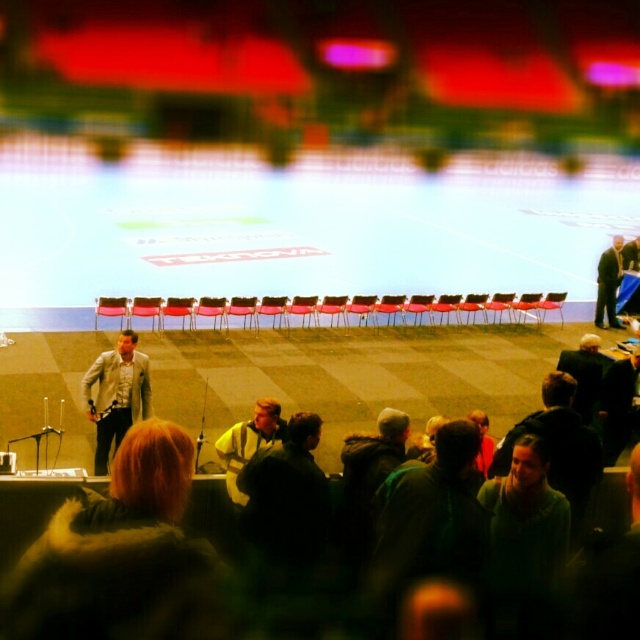
Which is above, yellow-green safety vest at center or dark gray suit at right?

dark gray suit at right

Does yellow-green safety vest at center have a smaller size compared to dark gray suit at right?

Yes.

Which is in front, point (228, 452) or point (605, 252)?

Point (228, 452) is in front.

Where is `yellow-green safety vest at center`? This screenshot has height=640, width=640. yellow-green safety vest at center is located at coordinates (248, 442).

Does light gray textured blazer at center have a larger size compared to dark gray jacket at right?

Correct, light gray textured blazer at center is larger in size than dark gray jacket at right.

Identify the location of light gray textured blazer at center. Image resolution: width=640 pixels, height=640 pixels. (116, 394).

What do you see at coordinates (116, 394) in the screenshot? The width and height of the screenshot is (640, 640). I see `light gray textured blazer at center` at bounding box center [116, 394].

The width and height of the screenshot is (640, 640). I want to click on light gray textured blazer at center, so click(116, 394).

Can you confirm if yellow-green safety vest at center is thinner than dark gray jacket at right?

In fact, yellow-green safety vest at center might be wider than dark gray jacket at right.

Between yellow-green safety vest at center and dark gray jacket at right, which one is positioned lower?

yellow-green safety vest at center

Who is more distant from viewer, (x=230, y=452) or (x=580, y=372)?

The point (x=580, y=372) is behind.

Identify the location of yellow-green safety vest at center. Image resolution: width=640 pixels, height=640 pixels. (248, 442).